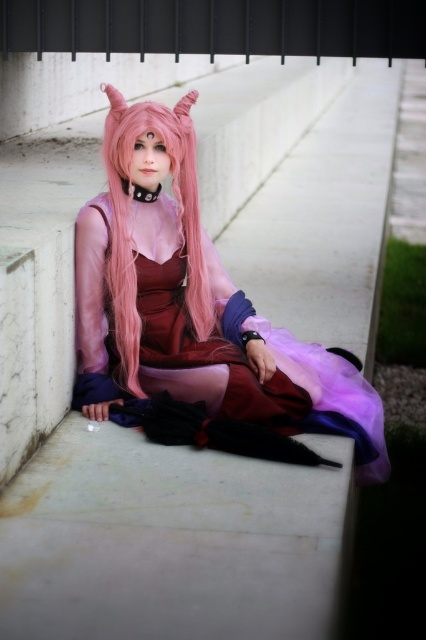
Based on the photo, you are a photographer taking a picture of the person in the scene. You notice the satin pink dress at center and the pink silky hair at center. Which object should you focus on first to ensure both are in sharp focus?

The satin pink dress at center is closer to the viewer than the pink silky hair at center. To ensure both are in sharp focus, you should focus on the satin pink dress at center first, as it is the closer object.

You are a costume designer who needs to ensure the safety of the costume during a performance. The satin pink dress at center and pink silky hair at center are part of the costume. Given that the minimum safe distance between costume elements to prevent tangling is 6 inches, is there a risk of tangling between these two elements?

The satin pink dress at center is 5.18 inches away from pink silky hair at center. Since the minimum safe distance is 6 inches, the current distance is insufficient, so there is a risk of tangling between these two elements.

You are a photographer trying to capture the perfect shot of the person in the scene. Since the satin pink dress at center and the pink silky hair at center are both important elements, which one should you focus on first to ensure it doesn t get cut out of the frame?

The satin pink dress at center is positioned under pink silky hair at center, so you should focus on capturing the pink silky hair at center first to prevent it from being cut out of the frame.